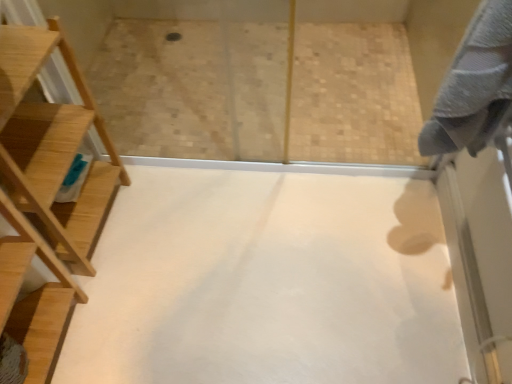
This screenshot has height=384, width=512. Find the location of `blank space above white matte floor at center (from a real-world perspective)`. blank space above white matte floor at center (from a real-world perspective) is located at coordinates (249, 268).